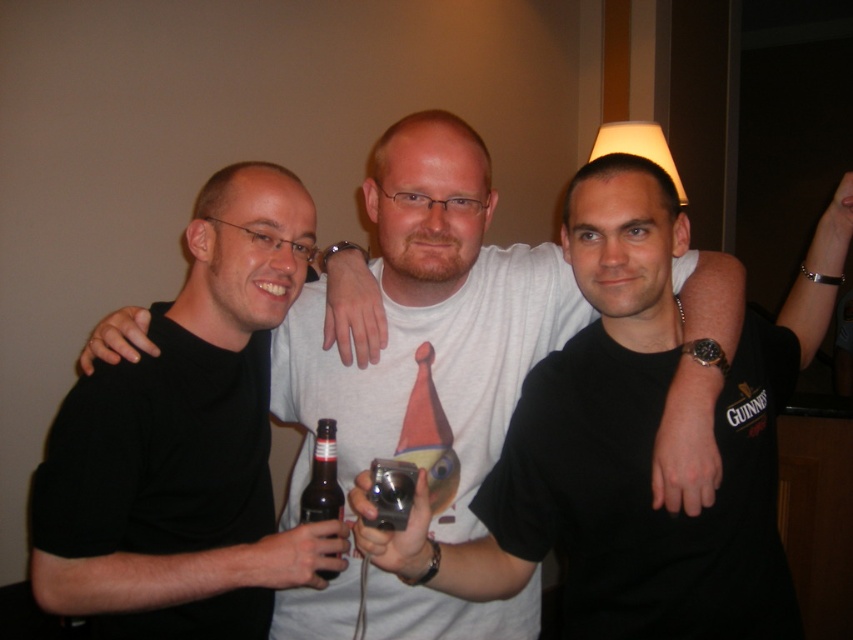
Question: Is brown glass bottle at center above metallic silver camera at center?

Choices:
 (A) no
 (B) yes

Answer: (A)

Question: Which object appears closest to the camera in this image?

Choices:
 (A) black matte shirt at left
 (B) brown glass bottle at center
 (C) white cotton t-shirt at center
 (D) metallic silver camera at center

Answer: (C)

Question: Is black matte shirt at left to the right of white cotton t-shirt at center from the viewer's perspective?

Choices:
 (A) no
 (B) yes

Answer: (A)

Question: Which point is closer to the camera taking this photo?

Choices:
 (A) (442, 561)
 (B) (183, 524)

Answer: (A)

Question: Can you confirm if black matte shirt at center is smaller than metallic silver camera at center?

Choices:
 (A) yes
 (B) no

Answer: (B)

Question: Which point is farther to the camera?

Choices:
 (A) (334, 573)
 (B) (415, 310)
 (C) (247, 381)
 (D) (392, 483)

Answer: (C)